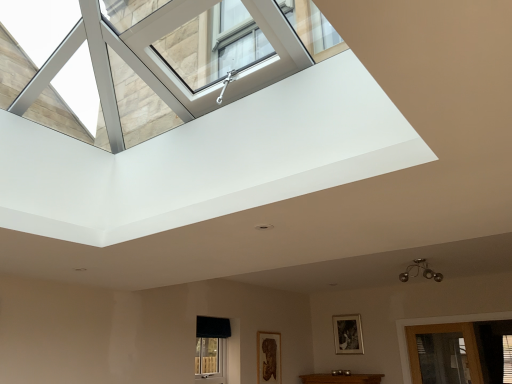
Question: From the image's perspective, does wooden picture frame at center, arranged as the second picture frame when viewed from the left, appear lower than wooden carved frame at lower center, marked as the first picture frame in a left-to-right arrangement?

Choices:
 (A) no
 (B) yes

Answer: (A)

Question: Does wooden picture frame at center, arranged as the second picture frame when viewed from the left, have a lesser height compared to wooden carved frame at lower center, marked as the first picture frame in a left-to-right arrangement?

Choices:
 (A) no
 (B) yes

Answer: (B)

Question: Considering the relative positions of wooden picture frame at center, acting as the 1th picture frame starting from the right, and wooden carved frame at lower center, marked as the first picture frame in a left-to-right arrangement, in the image provided, is wooden picture frame at center, acting as the 1th picture frame starting from the right, to the left of wooden carved frame at lower center, marked as the first picture frame in a left-to-right arrangement, from the viewer's perspective?

Choices:
 (A) yes
 (B) no

Answer: (B)

Question: From the image's perspective, is wooden picture frame at center, arranged as the second picture frame when viewed from the left, located above wooden carved frame at lower center, positioned as the 1th picture frame in front-to-back order?

Choices:
 (A) yes
 (B) no

Answer: (A)

Question: Is wooden picture frame at center, the 1th picture frame positioned from the back, not near wooden carved frame at lower center, marked as the first picture frame in a left-to-right arrangement?

Choices:
 (A) yes
 (B) no

Answer: (A)

Question: Is wooden picture frame at center, arranged as the second picture frame when viewed from the left, behind wooden carved frame at lower center, positioned as the 1th picture frame in front-to-back order?

Choices:
 (A) no
 (B) yes

Answer: (B)

Question: Is black fabric window at lower center completely or partially inside transparent glass door at lower right?

Choices:
 (A) no
 (B) yes

Answer: (A)

Question: From a real-world perspective, is transparent glass door at lower right below black fabric window at lower center?

Choices:
 (A) no
 (B) yes

Answer: (B)

Question: Can you confirm if transparent glass door at lower right is smaller than black fabric window at lower center?

Choices:
 (A) yes
 (B) no

Answer: (B)

Question: Can you confirm if transparent glass door at lower right is positioned to the left of black fabric window at lower center?

Choices:
 (A) no
 (B) yes

Answer: (A)

Question: Could you tell me if transparent glass door at lower right is facing black fabric window at lower center?

Choices:
 (A) yes
 (B) no

Answer: (B)

Question: Is transparent glass door at lower right in front of black fabric window at lower center?

Choices:
 (A) yes
 (B) no

Answer: (B)

Question: Does wooden picture frame at center, the 1th picture frame positioned from the back, lie in front of transparent glass door at lower right?

Choices:
 (A) yes
 (B) no

Answer: (B)